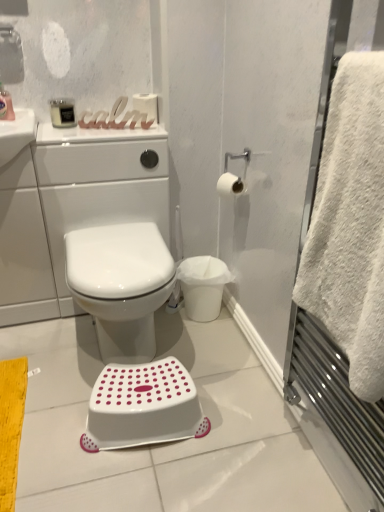
This screenshot has height=512, width=384. Identify the location of free space in front of white glossy bidet at center. (86, 452).